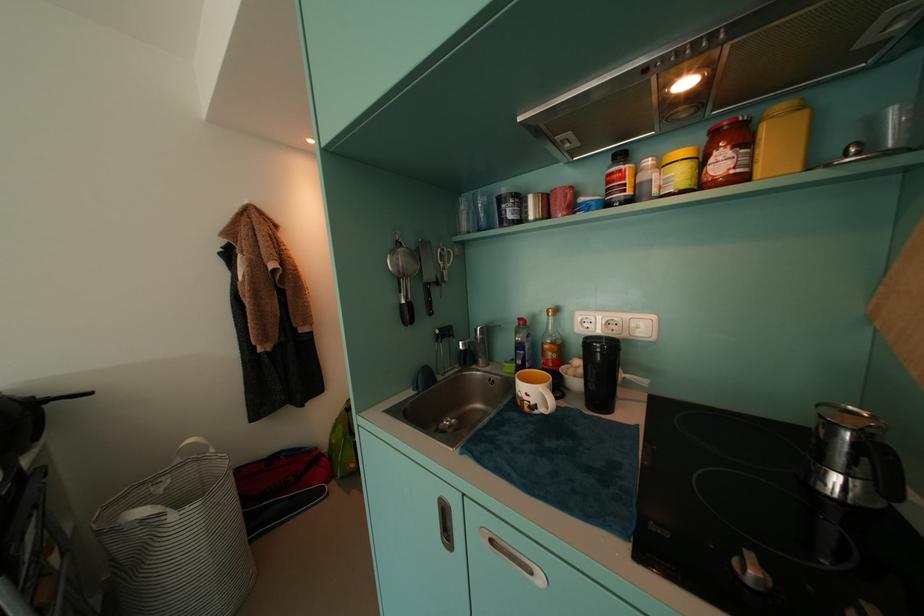
Find the location of a particular element. This screenshot has height=616, width=924. yellow mug handle is located at coordinates (533, 391).